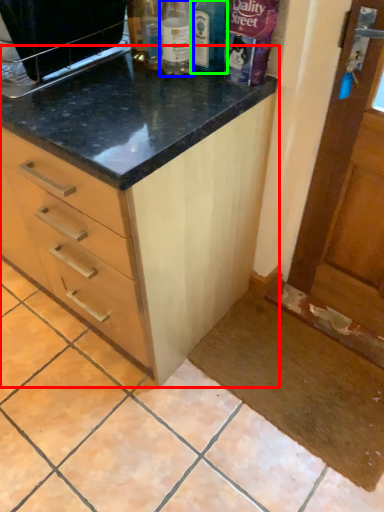
Question: Considering the real-world distances, which object is closest to cabinetry (highlighted by a red box)? bottle (highlighted by a blue box) or bottle (highlighted by a green box).

Choices:
 (A) bottle
 (B) bottle

Answer: (A)